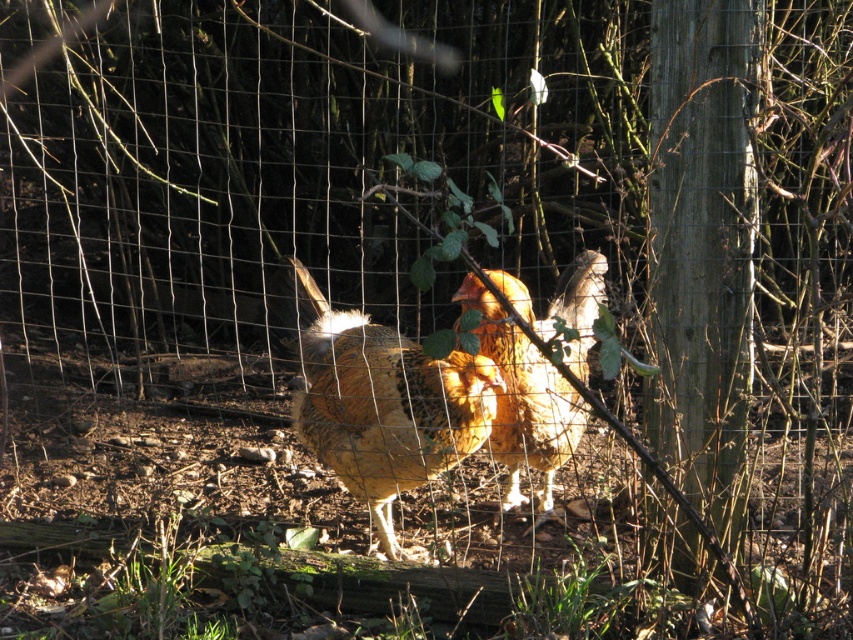
Question: Can you confirm if golden speckled chicken at center is positioned to the right of golden feathered chicken at center?

Choices:
 (A) no
 (B) yes

Answer: (A)

Question: Is golden speckled chicken at center positioned before golden feathered chicken at center?

Choices:
 (A) yes
 (B) no

Answer: (B)

Question: Does golden speckled chicken at center have a lesser width compared to golden feathered chicken at center?

Choices:
 (A) no
 (B) yes

Answer: (A)

Question: Which object is closer to the camera taking this photo?

Choices:
 (A) golden feathered chicken at center
 (B) golden speckled chicken at center

Answer: (A)